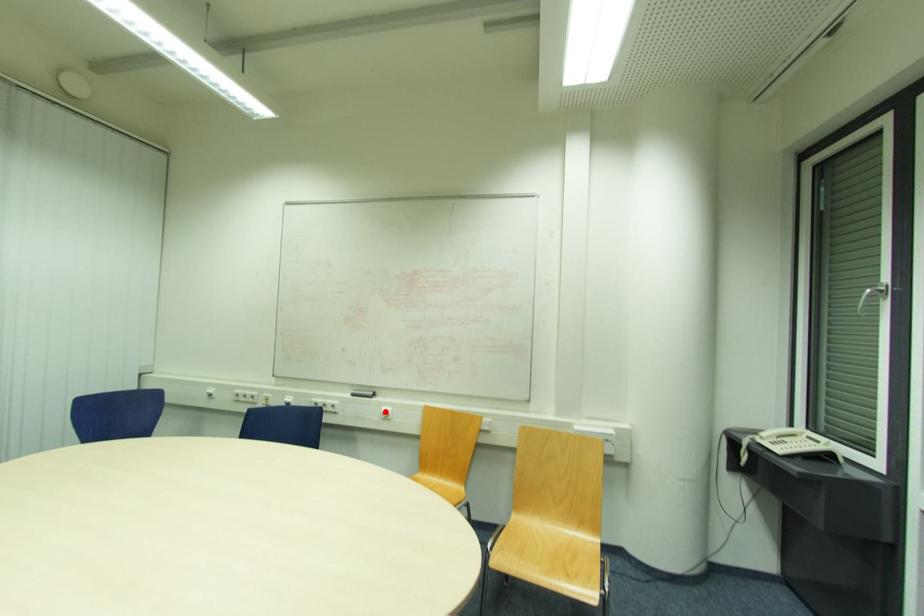
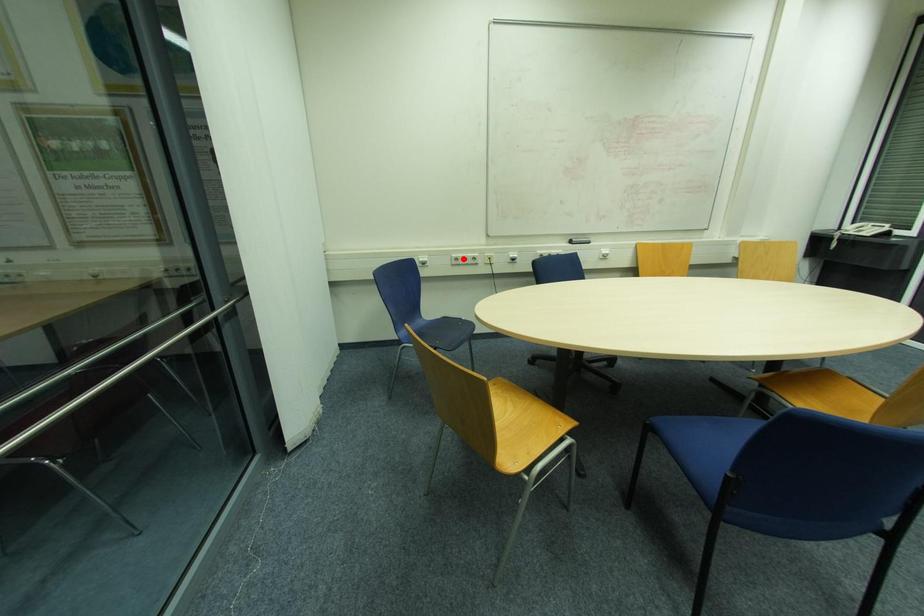
I am providing you with two images of the same scene from different viewpoints. A red point is marked on the first image and another point is marked on the second image. Is the red point in image1 aligned with the point shown in image2?

No